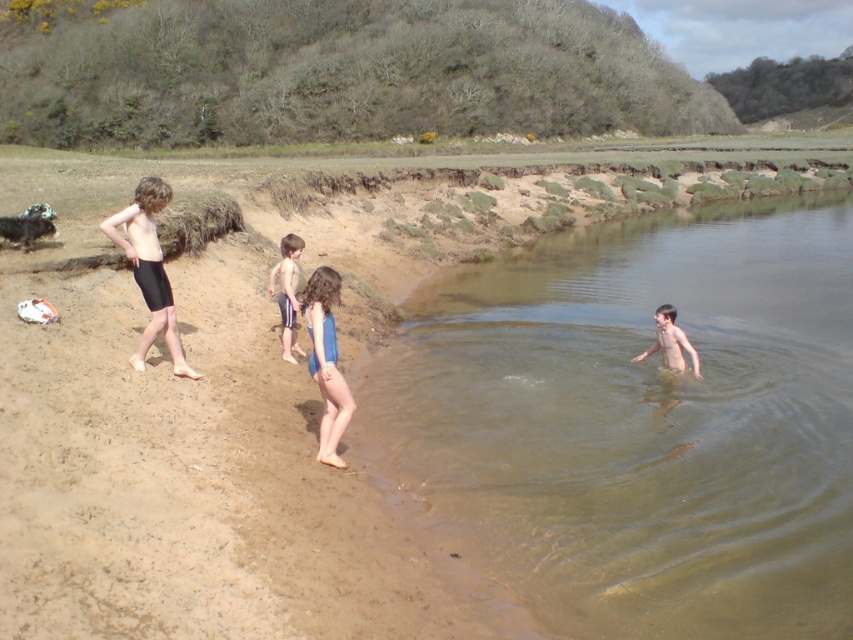
Question: Which point is closer to the camera?

Choices:
 (A) blue fabric shorts at center
 (B) blue fabric swimsuit at center
 (C) light brown skin at water right
 (D) black matte shorts at left

Answer: (B)

Question: Is black matte shorts at left further to camera compared to blue fabric shorts at center?

Choices:
 (A) yes
 (B) no

Answer: (B)

Question: Which object is farther from the camera taking this photo?

Choices:
 (A) light brown skin at water right
 (B) black matte shorts at left

Answer: (A)

Question: Considering the relative positions of blue fabric swimsuit at center and light brown skin at water right in the image provided, where is blue fabric swimsuit at center located with respect to light brown skin at water right?

Choices:
 (A) right
 (B) left

Answer: (B)

Question: Does blue fabric shorts at center appear on the left side of light brown skin at water right?

Choices:
 (A) yes
 (B) no

Answer: (A)

Question: Among these objects, which one is farthest from the camera?

Choices:
 (A) black matte shorts at left
 (B) blue fabric swimsuit at center
 (C) clear water at right
 (D) light brown skin at water right

Answer: (D)